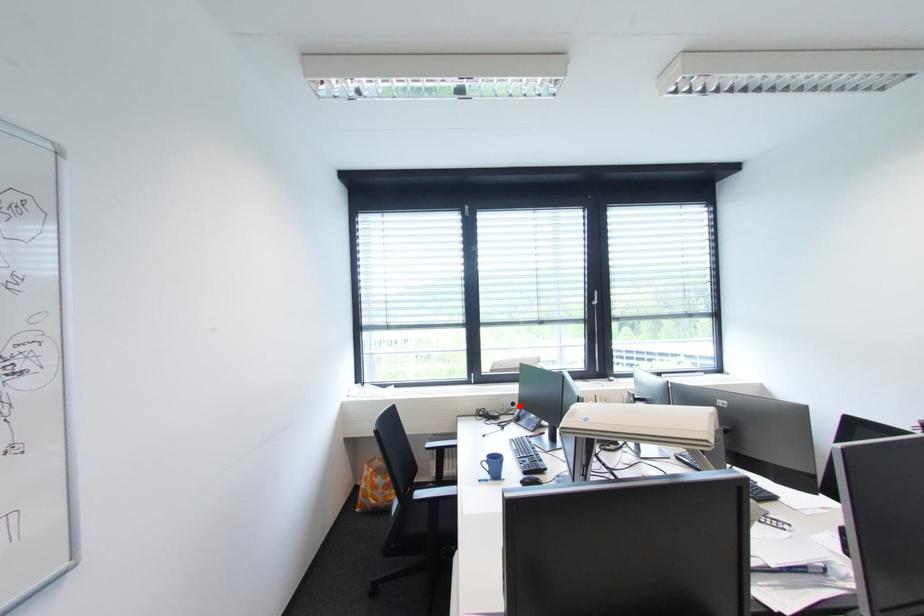
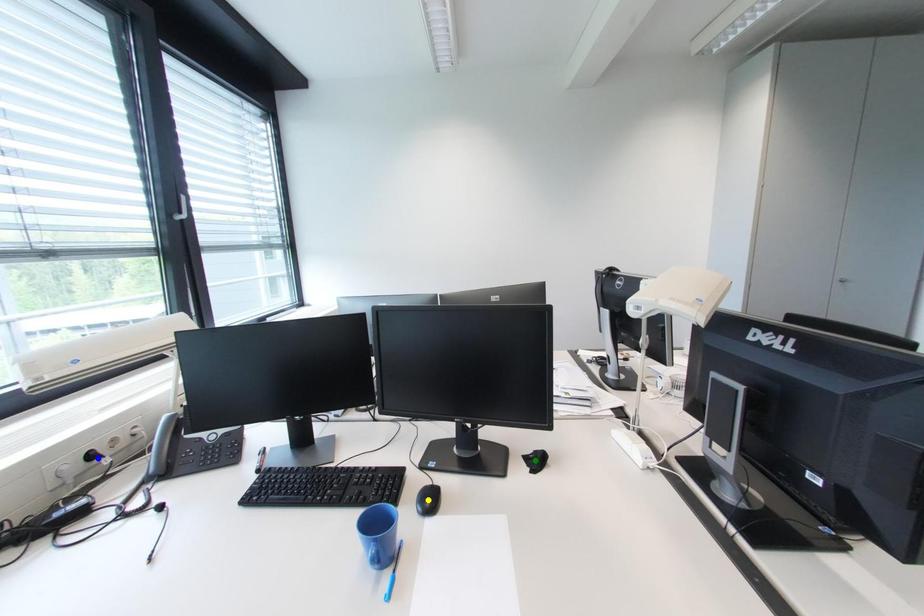
Question: I am providing you with two images of the same scene from different viewpoints. A red point is marked on the first image. You are given multiple points on the second image. Which mark in image 2 goes with the point in image 1?

Choices:
 (A) yellow point
 (B) blue point
 (C) green point

Answer: (B)